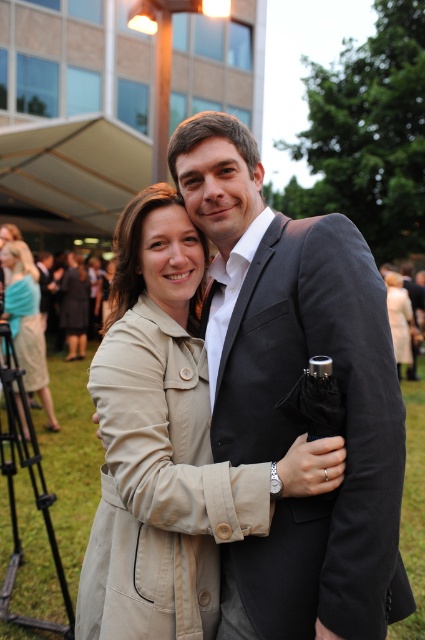
Question: Which object is closer to the camera taking this photo?

Choices:
 (A) beige fabric coat at center
 (B) beige fabric coat at lower right

Answer: (A)

Question: From the image, what is the correct spatial relationship of beige trench coat at lower left in relation to beige fabric coat at lower right?

Choices:
 (A) below
 (B) above

Answer: (A)

Question: Does matte black suit at center have a greater width compared to beige fabric coat at lower right?

Choices:
 (A) yes
 (B) no

Answer: (A)

Question: Which point is closer to the camera?

Choices:
 (A) (125, 221)
 (B) (215, 387)

Answer: (B)

Question: Among these objects, which one is farthest from the camera?

Choices:
 (A) matte black suit at center
 (B) beige fabric coat at lower right
 (C) beige fabric coat at center
 (D) beige trench coat at lower left

Answer: (B)

Question: Does beige fabric coat at center appear on the right side of beige trench coat at lower left?

Choices:
 (A) no
 (B) yes

Answer: (B)